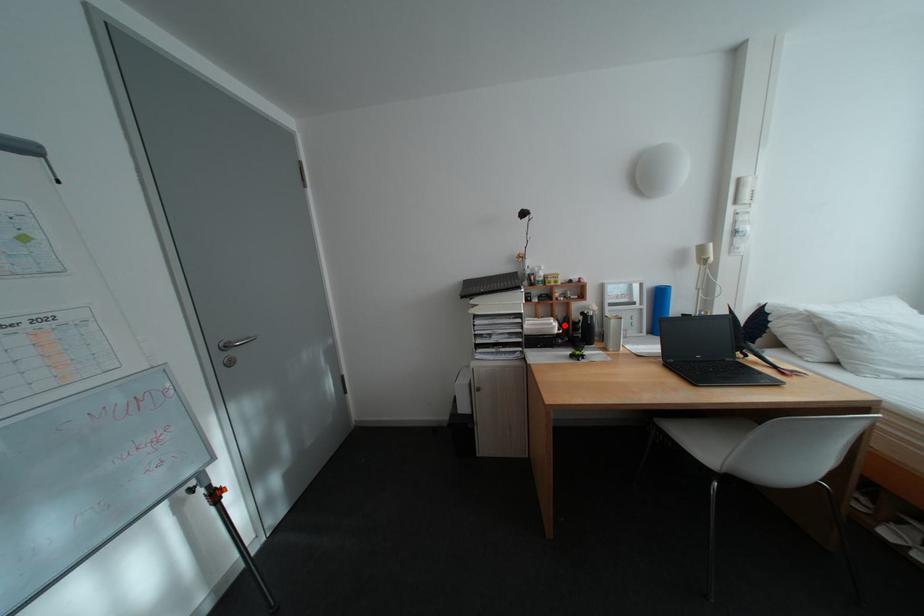
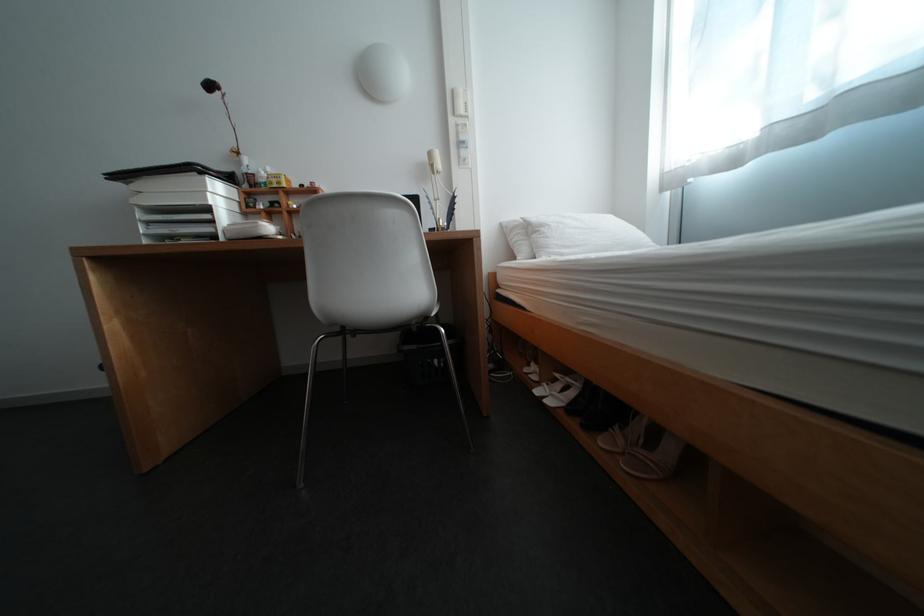
Where in the second image is the point corresponding to the highlighted location from the first image?

(270, 224)